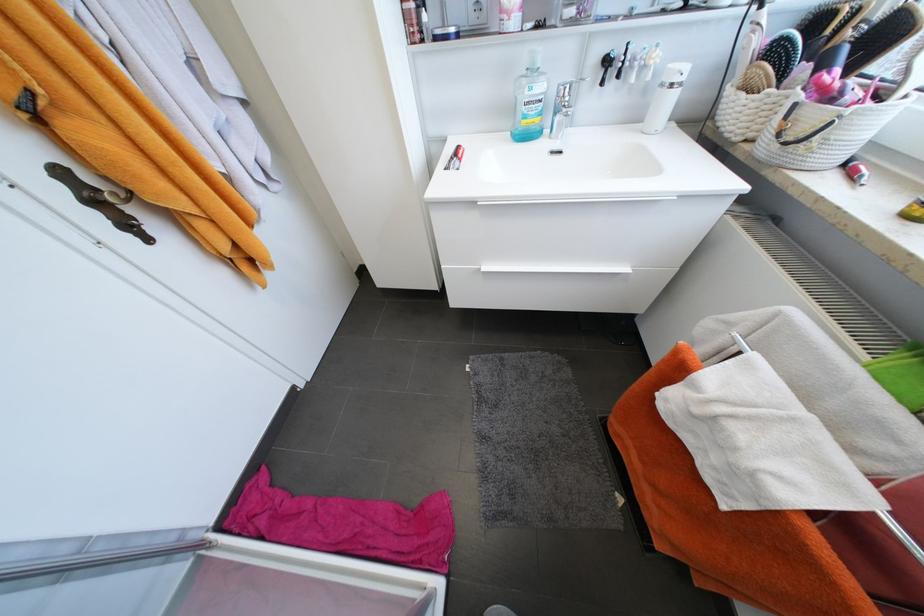
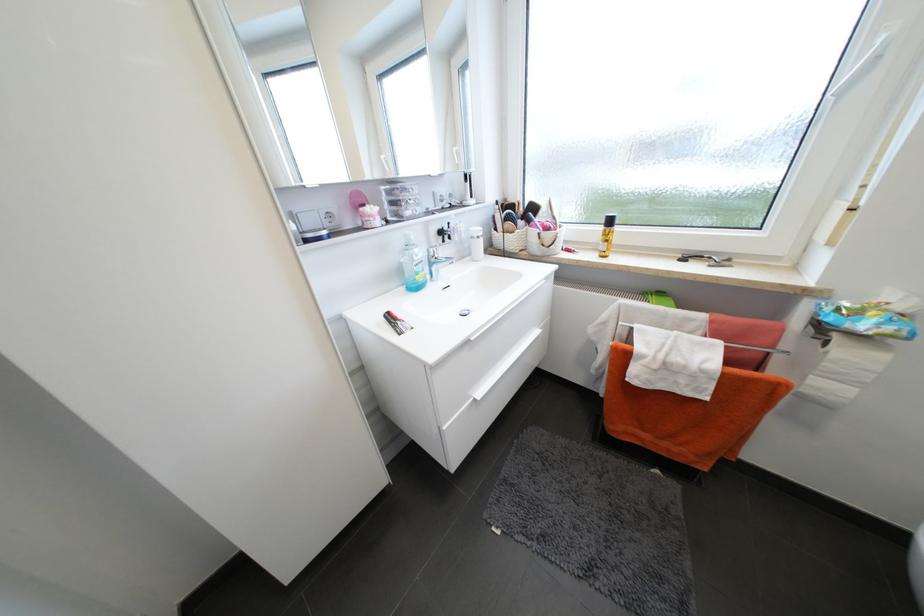
Where in the second image is the point corresponding to (800,107) from the first image?

(544, 235)